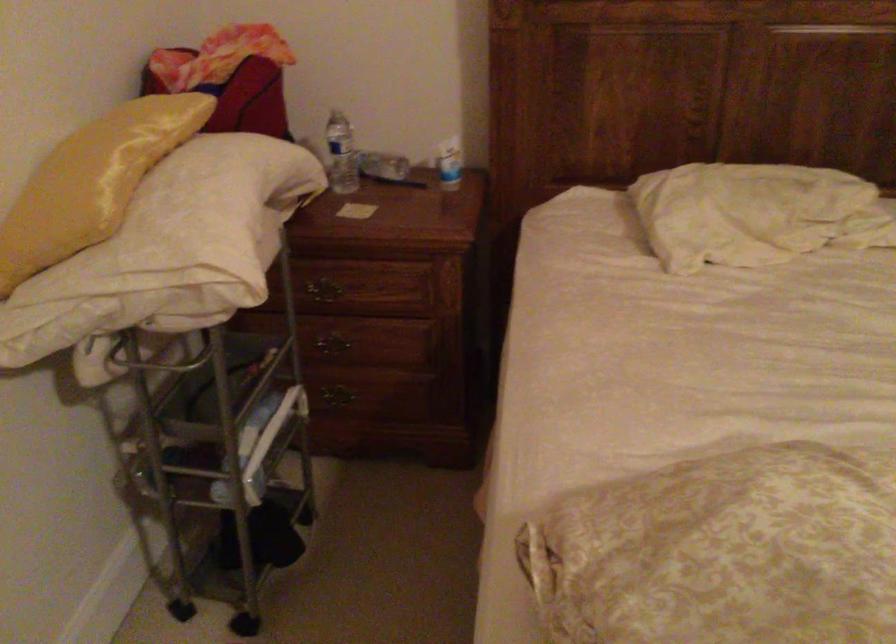
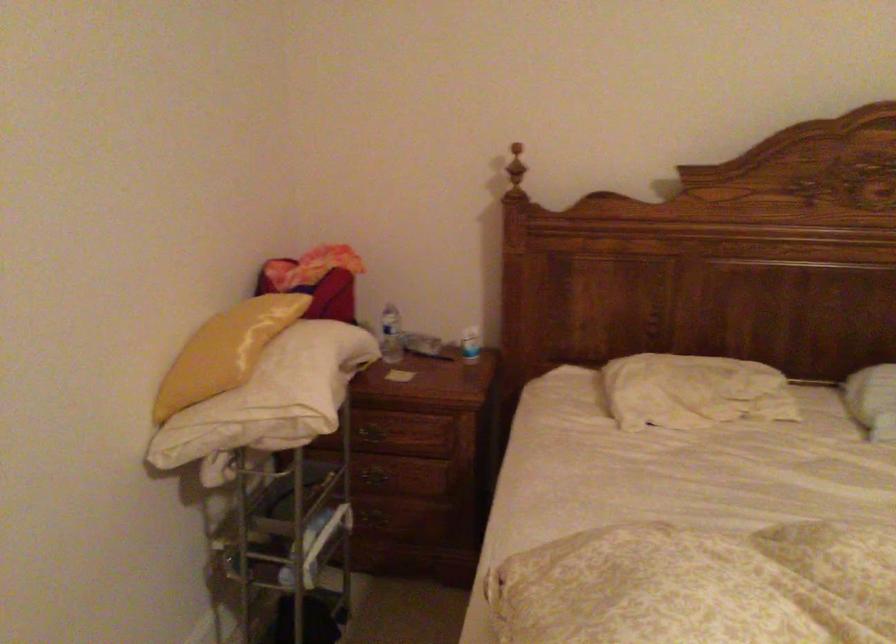
Where in the second image is the point corresponding to point (325, 285) from the first image?

(374, 430)